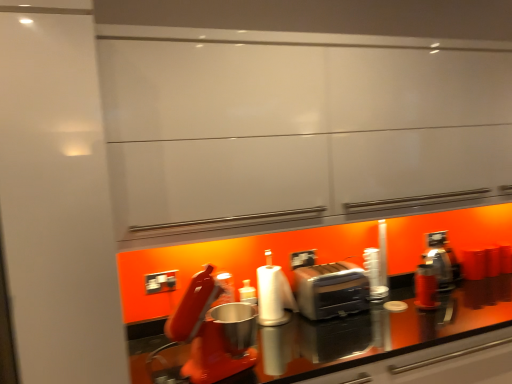
Question: From a real-world perspective, is white matte paper towel at center physically below satin silver toaster at center?

Choices:
 (A) yes
 (B) no

Answer: (B)

Question: Does white matte paper towel at center appear on the left side of satin silver toaster at center?

Choices:
 (A) yes
 (B) no

Answer: (A)

Question: Does white matte paper towel at center turn towards satin silver toaster at center?

Choices:
 (A) yes
 (B) no

Answer: (B)

Question: Are white matte paper towel at center and satin silver toaster at center beside each other?

Choices:
 (A) no
 (B) yes

Answer: (A)

Question: Is the depth of white matte paper towel at center less than that of satin silver toaster at center?

Choices:
 (A) yes
 (B) no

Answer: (A)

Question: Can you confirm if white matte paper towel at center is taller than satin silver toaster at center?

Choices:
 (A) yes
 (B) no

Answer: (A)

Question: From a real-world perspective, is satin silver toaster at center positioned over white matte paper towel at center based on gravity?

Choices:
 (A) yes
 (B) no

Answer: (B)

Question: From the image's perspective, is satin silver toaster at center located beneath white matte paper towel at center?

Choices:
 (A) yes
 (B) no

Answer: (A)

Question: Is satin silver toaster at center to the right of white matte paper towel at center from the viewer's perspective?

Choices:
 (A) yes
 (B) no

Answer: (A)

Question: Is satin silver toaster at center aimed at white matte paper towel at center?

Choices:
 (A) no
 (B) yes

Answer: (A)

Question: Is satin silver toaster at center behind white matte paper towel at center?

Choices:
 (A) yes
 (B) no

Answer: (A)

Question: Is satin silver toaster at center smaller than white matte paper towel at center?

Choices:
 (A) no
 (B) yes

Answer: (A)

Question: Based on their sizes in the image, would you say satin silver toaster at center is bigger or smaller than white matte paper towel at center?

Choices:
 (A) big
 (B) small

Answer: (A)